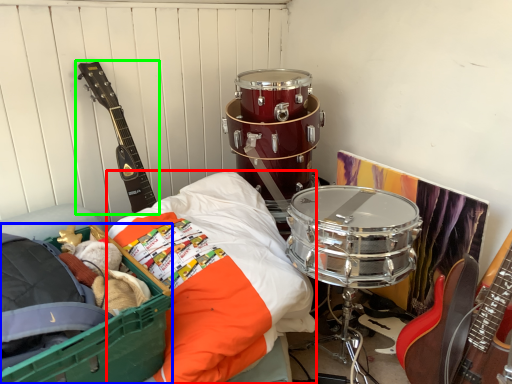
Question: Considering the real-world distances, which object is farthest from sheet (highlighted by a red box)? storage box (highlighted by a blue box) or guitar (highlighted by a green box)?

Choices:
 (A) storage box
 (B) guitar

Answer: (B)